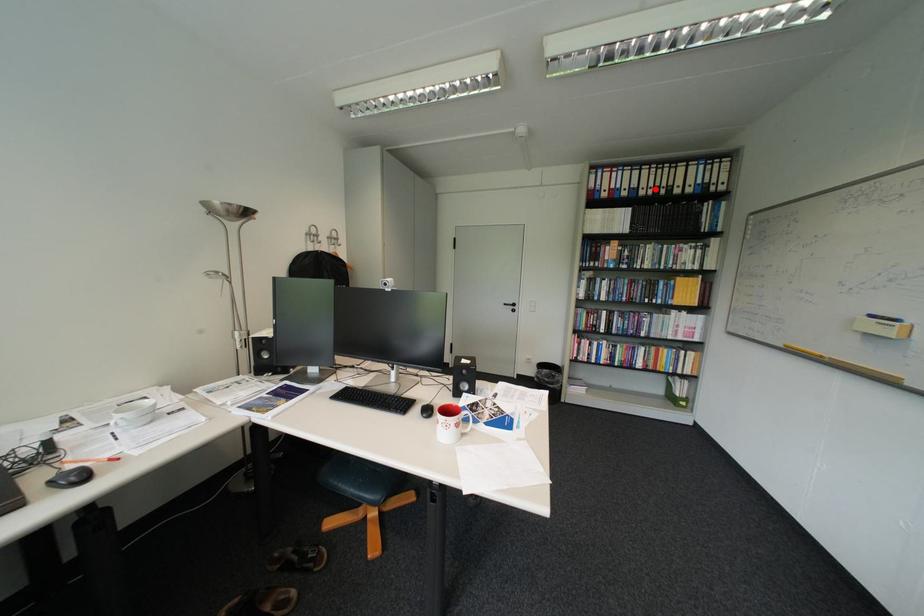
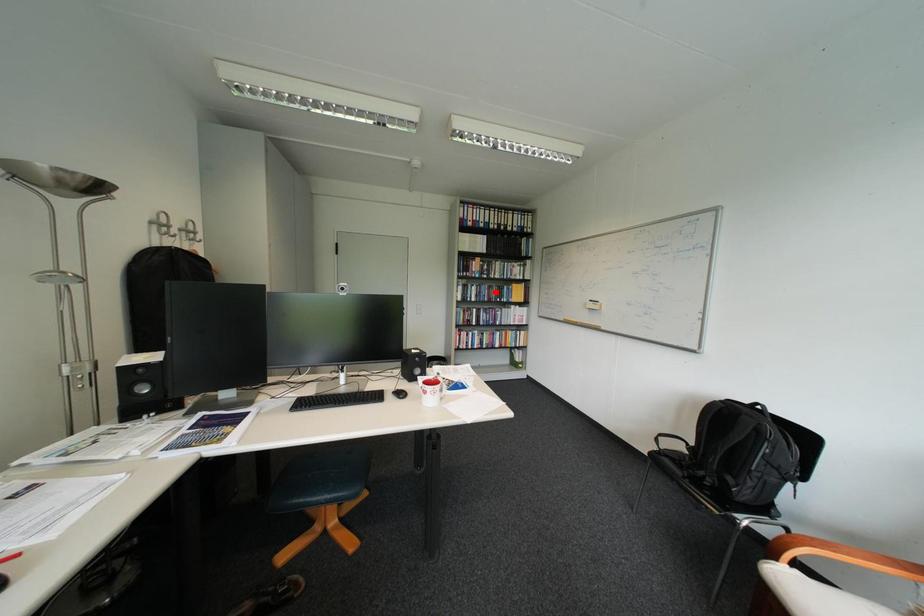
I am providing you with two images of the same scene from different viewpoints. A red point is marked on the first image and another point is marked on the second image. Is the marked point in image1 the same physical position as the marked point in image2?

No